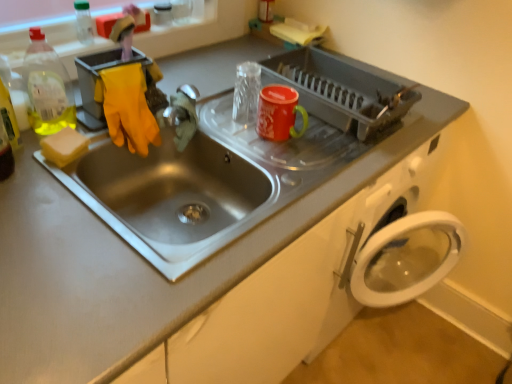
Identify the location of free space in front of yellow sponge at left. The height and width of the screenshot is (384, 512). (47, 197).